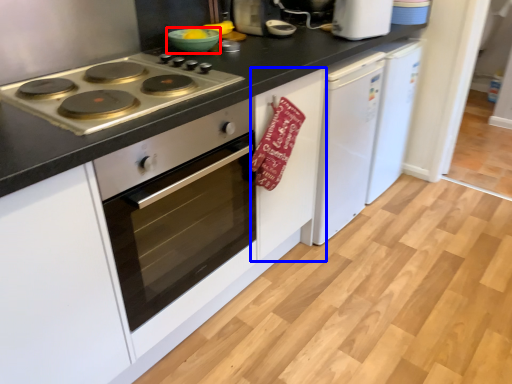
Question: Which object appears farthest to the camera in this image, bowl (highlighted by a red box) or cabinetry (highlighted by a blue box)?

Choices:
 (A) bowl
 (B) cabinetry

Answer: (A)